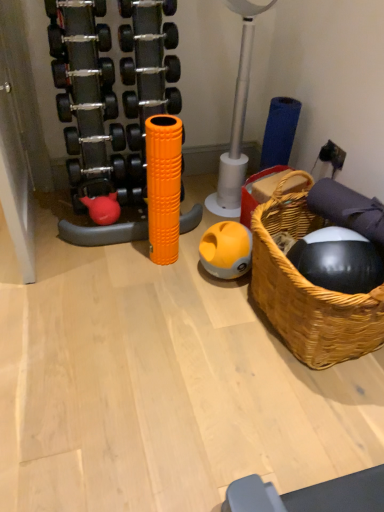
At what (x,y) coordinates should I click in order to perform the action: click on free area in between yellow matte ball at center and orange foam roller at center. Please return your answer as a coordinate pair (x, y). Looking at the image, I should click on (190, 267).